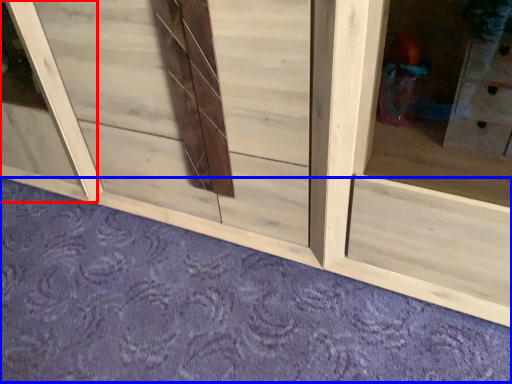
Question: Which object appears closest to the camera in this image, window frame (highlighted by a red box) or plain (highlighted by a blue box)?

Choices:
 (A) window frame
 (B) plain

Answer: (B)